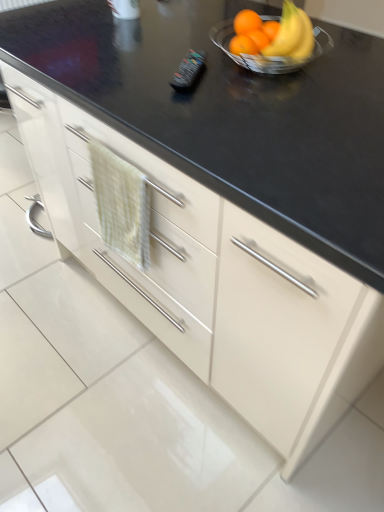
Image resolution: width=384 pixels, height=512 pixels. What do you see at coordinates (268, 57) in the screenshot?
I see `clear glass bowl at upper right` at bounding box center [268, 57].

In order to face green textured hand towel at center-left, should I rotate leftwards or rightwards?

Rotate left and turn 10.244 degrees.

The image size is (384, 512). Find the location of `black plastic remote control at center`. black plastic remote control at center is located at coordinates (188, 70).

Does green textured hand towel at center-left have a greater width compared to clear glass bowl at upper right?

In fact, green textured hand towel at center-left might be narrower than clear glass bowl at upper right.

Which object is more forward, green textured hand towel at center-left or clear glass bowl at upper right?

green textured hand towel at center-left.

Is clear glass bowl at upper right a part of green textured hand towel at center-left?

Definitely not — clear glass bowl at upper right is not inside green textured hand towel at center-left.

In order to click on glass bowl positioned vertically above the green textured hand towel at center-left (from a real-world perspective) in this screenshot , I will do `click(268, 57)`.

From a real-world perspective, is clear glass bowl at upper right physically below black plastic remote control at center?

No, from a real-world perspective, clear glass bowl at upper right is not under black plastic remote control at center.

At what (x,y) coordinates should I click in order to perform the action: click on glass bowl in front of the black plastic remote control at center. Please return your answer as a coordinate pair (x, y). Looking at the image, I should click on (268, 57).

Does clear glass bowl at upper right lie in front of black plastic remote control at center?

Yes, clear glass bowl at upper right is closer to the viewer.

Is point (279, 19) closer to camera compared to point (184, 74)?

That is False.

Is black plastic remote control at center to the right of clear glass bowl at upper right from the viewer's perspective?

No.

Find the location of `glass bowl that appears above the black plastic remote control at center (from a real-world perspective)`. glass bowl that appears above the black plastic remote control at center (from a real-world perspective) is located at coordinates (268, 57).

From the image's perspective, is black plastic remote control at center positioned above or below clear glass bowl at upper right?

Clearly, from the image's perspective, black plastic remote control at center is below clear glass bowl at upper right.

Which object is further away from the camera taking this photo, shiny metallic bowl at upper right or black plastic remote control at center?

black plastic remote control at center is further from the camera.

Is shiny metallic bowl at upper right far away from black plastic remote control at center?

shiny metallic bowl at upper right is actually quite close to black plastic remote control at center.

From the image's perspective, which one is positioned higher, shiny metallic bowl at upper right or black plastic remote control at center?

shiny metallic bowl at upper right appears higher in the image.

Is point (264, 36) positioned in front of point (285, 27)?

No, (264, 36) is behind (285, 27).

From the image's perspective, does orange matte at upper right appear lower than shiny metallic bowl at upper right?

No.

Considering the positions of objects orange matte at upper right and shiny metallic bowl at upper right in the image provided, who is more to the left, orange matte at upper right or shiny metallic bowl at upper right?

orange matte at upper right is more to the left.

Locate an element on the screen. This screenshot has height=512, width=384. grapefruit in front of the orange matte at upper right is located at coordinates (274, 34).

From the image's perspective, is orange matte at upper right positioned above or below black plastic remote control at center?

orange matte at upper right is above black plastic remote control at center.

Would you say orange matte at upper right is inside or outside black plastic remote control at center?

orange matte at upper right exists outside the volume of black plastic remote control at center.

In terms of height, does orange matte at upper right look taller or shorter compared to black plastic remote control at center?

orange matte at upper right is taller than black plastic remote control at center.

In terms of size, does orange matte at upper right appear bigger or smaller than black plastic remote control at center?

orange matte at upper right is bigger than black plastic remote control at center.

Looking at this image, considering the sizes of shiny metallic bowl at upper right and clear glass bowl at upper right in the image, is shiny metallic bowl at upper right taller or shorter than clear glass bowl at upper right?

shiny metallic bowl at upper right is taller than clear glass bowl at upper right.

Locate an element on the screen. This screenshot has height=512, width=384. grapefruit that is in front of the clear glass bowl at upper right is located at coordinates (274, 34).

From a real-world perspective, is shiny metallic bowl at upper right positioned above or below clear glass bowl at upper right?

shiny metallic bowl at upper right is situated higher than clear glass bowl at upper right in the real world.

Considering the sizes of objects shiny metallic bowl at upper right and clear glass bowl at upper right in the image provided, who is bigger, shiny metallic bowl at upper right or clear glass bowl at upper right?

clear glass bowl at upper right is bigger.

The height and width of the screenshot is (512, 384). I want to click on glass bowl positioned vertically above the green textured hand towel at center-left (from a real-world perspective), so click(x=268, y=57).

The width and height of the screenshot is (384, 512). In order to click on appliance lying below the clear glass bowl at upper right (from the image's perspective) in this screenshot , I will do `click(188, 70)`.

Consider the image. Looking at the image, which one is located closer to orange matte at upper right, black plastic remote control at center or clear glass bowl at upper right?

The object closer to orange matte at upper right is clear glass bowl at upper right.

Based on their spatial positions, is shiny metallic bowl at upper right or orange matte at upper right closer to green textured hand towel at center-left?

orange matte at upper right is positioned closer to the anchor green textured hand towel at center-left.

Looking at the image, which one is located further to shiny metallic bowl at upper right, black plastic remote control at center or green textured hand towel at center-left?

green textured hand towel at center-left.

Which object lies nearer to the anchor point green textured hand towel at center-left, black plastic remote control at center or shiny metallic bowl at upper right?

black plastic remote control at center is positioned closer to the anchor green textured hand towel at center-left.

Which object lies further to the anchor point black plastic remote control at center, orange matte at upper right or clear glass bowl at upper right?

Based on the image, clear glass bowl at upper right appears to be further to black plastic remote control at center.

Looking at the image, which one is located further to clear glass bowl at upper right, green textured hand towel at center-left or black plastic remote control at center?

green textured hand towel at center-left lies further to clear glass bowl at upper right than the other object.

Based on their spatial positions, is green textured hand towel at center-left or clear glass bowl at upper right further from orange matte at upper right?

green textured hand towel at center-left is positioned further to the anchor orange matte at upper right.

When comparing their distances from green textured hand towel at center-left, does black plastic remote control at center or orange matte at upper right seem closer?

The object closer to green textured hand towel at center-left is black plastic remote control at center.

Find the location of a particular element. citrus fruit between black plastic remote control at center and shiny metallic bowl at upper right is located at coordinates (252, 33).

Where is `glass bowl between black plastic remote control at center and shiny metallic bowl at upper right in the horizontal direction`? The width and height of the screenshot is (384, 512). glass bowl between black plastic remote control at center and shiny metallic bowl at upper right in the horizontal direction is located at coordinates (268, 57).

This screenshot has width=384, height=512. What are the coordinates of `glass bowl located between shiny metallic bowl at upper right and orange matte at upper right in the depth direction` in the screenshot? It's located at (268, 57).

The height and width of the screenshot is (512, 384). Identify the location of citrus fruit situated between black plastic remote control at center and clear glass bowl at upper right from left to right. (252, 33).